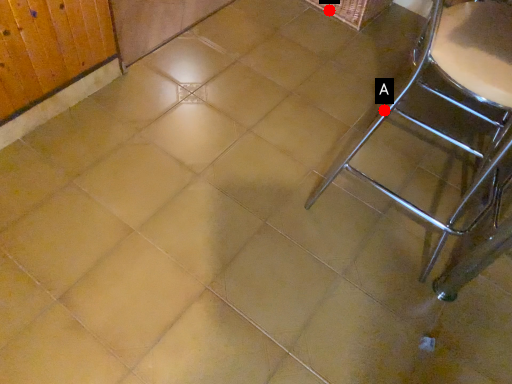
Question: Two points are circled on the image, labeled by A and B beside each circle. Which point appears closest to the camera in this image?

Choices:
 (A) A is closer
 (B) B is closer

Answer: (A)